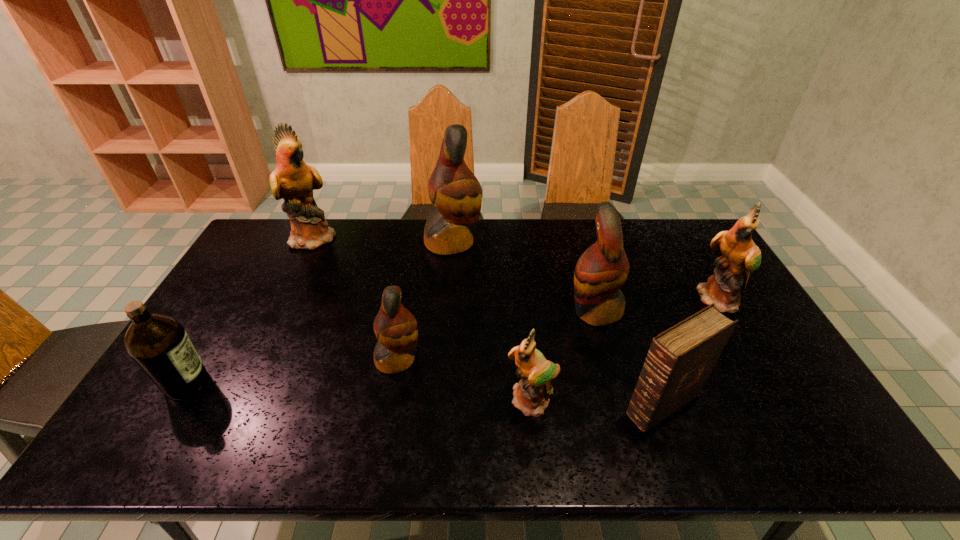
The image size is (960, 540). In the image, there is a desktop. What are the coordinates of `vacant area at the left edge` in the screenshot? It's located at pos(204,403).

Identify the location of free location at the right edge. This screenshot has height=540, width=960. (761, 381).

In order to click on free location at the near right corner of the desktop in this screenshot , I will do `click(787, 457)`.

Locate an element on the screen. Image resolution: width=960 pixels, height=540 pixels. empty space between the Bible and the biggest red parrot is located at coordinates (558, 323).

Where is `free point between the fifth parrot from left to right and the farthest red parrot`? This screenshot has width=960, height=540. free point between the fifth parrot from left to right and the farthest red parrot is located at coordinates (524, 276).

The width and height of the screenshot is (960, 540). Identify the location of vacant area between the farthest red parrot and the leftmost green parrot. (384, 239).

The height and width of the screenshot is (540, 960). I want to click on free space between the smallest red parrot and the brown olive oil, so click(x=292, y=371).

Locate an element on the screen. This screenshot has width=960, height=540. vacant area that lies between the Bible and the brown olive oil is located at coordinates (424, 394).

Where is `blank region between the fifth farthest parrot and the olive oil`? This screenshot has width=960, height=540. blank region between the fifth farthest parrot and the olive oil is located at coordinates (292, 371).

Locate an element on the screen. The height and width of the screenshot is (540, 960). free space between the brown olive oil and the rightmost parrot is located at coordinates (453, 341).